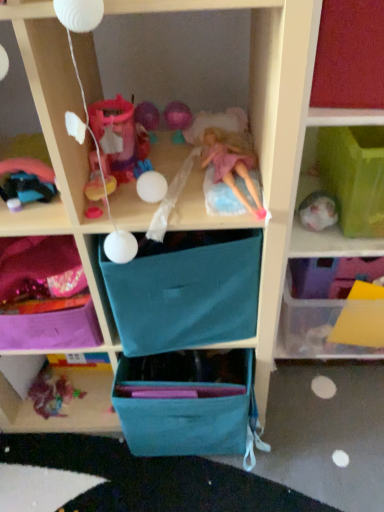
Question: Is teal fabric drawer at center, arranged as the 2th drawer when ordered from the bottom, closer to the viewer compared to purple fabric bag at lower left, which appears as the 3th shelf when viewed from the right?

Choices:
 (A) yes
 (B) no

Answer: (A)

Question: Is teal fabric drawer at center, arranged as the 2th drawer when ordered from the bottom, facing away from purple fabric bag at lower left, which appears as the 3th shelf when viewed from the right?

Choices:
 (A) yes
 (B) no

Answer: (B)

Question: From the image's perspective, would you say teal fabric drawer at center, arranged as the 2th drawer when ordered from the bottom, is positioned over purple fabric bag at lower left, which appears as the 3th shelf when viewed from the right?

Choices:
 (A) yes
 (B) no

Answer: (A)

Question: Is teal fabric drawer at center, placed as the 1th drawer when sorted from top to bottom, facing towards purple fabric bag at lower left, which appears as the 3th shelf when viewed from the right?

Choices:
 (A) no
 (B) yes

Answer: (A)

Question: From the image's perspective, is teal fabric drawer at center, arranged as the 2th drawer when ordered from the bottom, below purple fabric bag at lower left, which appears as the 3th shelf when viewed from the right?

Choices:
 (A) no
 (B) yes

Answer: (A)

Question: From their relative heights in the image, would you say shiny metallic car at left, arranged as the first toy when viewed from the front, is taller or shorter than pink fabric doll at center?

Choices:
 (A) short
 (B) tall

Answer: (B)

Question: Do you think shiny metallic car at left, arranged as the first toy when viewed from the front, is within pink fabric doll at center, or outside of it?

Choices:
 (A) inside
 (B) outside

Answer: (B)

Question: From a real-world perspective, is shiny metallic car at left, the 2th toy from the bottom, above or below pink fabric doll at center?

Choices:
 (A) above
 (B) below

Answer: (A)

Question: Considering the positions of shiny metallic car at left, placed as the 1th toy when sorted from top to bottom, and pink fabric doll at center in the image, is shiny metallic car at left, placed as the 1th toy when sorted from top to bottom, bigger or smaller than pink fabric doll at center?

Choices:
 (A) small
 (B) big

Answer: (B)

Question: Looking at their shapes, would you say multicolored fabric toy at lower left, which ranks as the first toy in bottom-to-top order, is wider or thinner than purple fabric bag at lower left, arranged as the first shelf when viewed from the left?

Choices:
 (A) wide
 (B) thin

Answer: (B)

Question: In terms of height, does multicolored fabric toy at lower left, arranged as the 1th toy when viewed from the back, look taller or shorter compared to purple fabric bag at lower left, arranged as the first shelf when viewed from the left?

Choices:
 (A) tall
 (B) short

Answer: (B)

Question: In terms of size, does multicolored fabric toy at lower left, which is counted as the 2th toy, starting from the top, appear bigger or smaller than purple fabric bag at lower left, arranged as the first shelf when viewed from the left?

Choices:
 (A) big
 (B) small

Answer: (B)

Question: Would you say multicolored fabric toy at lower left, which appears as the second toy when viewed from the front, is to the left or to the right of purple fabric bag at lower left, which appears as the 3th shelf when viewed from the right, in the picture?

Choices:
 (A) right
 (B) left

Answer: (B)

Question: Considering the positions of pink fabric doll at center and shiny metallic car at left, arranged as the first toy when viewed from the front, in the image, is pink fabric doll at center wider or thinner than shiny metallic car at left, arranged as the first toy when viewed from the front,?

Choices:
 (A) thin
 (B) wide

Answer: (B)

Question: From the image's perspective, is pink fabric doll at center located above or below shiny metallic car at left, placed as the 1th toy when sorted from top to bottom?

Choices:
 (A) below
 (B) above

Answer: (B)